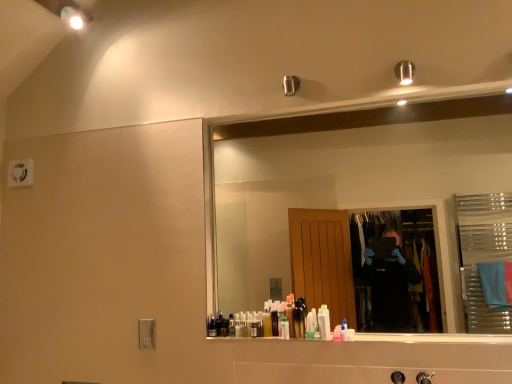
Question: From a real-world perspective, is translucent plastic bottle at center, the 4th toiletry when ordered from right to left, beneath white glossy lotion at center, which is the fifth toiletry from left to right?

Choices:
 (A) no
 (B) yes

Answer: (A)

Question: Is translucent plastic bottle at center, which is the third toiletry from left to right, thinner than white glossy lotion at center, which is the fifth toiletry from left to right?

Choices:
 (A) no
 (B) yes

Answer: (A)

Question: Is translucent plastic bottle at center, which is the third toiletry from left to right, not close to white glossy lotion at center, the 2th toiletry from the right?

Choices:
 (A) no
 (B) yes

Answer: (A)

Question: From the image's perspective, is translucent plastic bottle at center, which is the third toiletry from left to right, over white glossy lotion at center, the 2th toiletry from the right?

Choices:
 (A) yes
 (B) no

Answer: (A)

Question: Is white glossy lotion at center, which is the fifth toiletry from left to right, completely or partially inside translucent plastic bottle at center, the 4th toiletry when ordered from right to left?

Choices:
 (A) yes
 (B) no

Answer: (B)

Question: Is translucent plastic bottle at center, which is the third toiletry from left to right, completely or partially outside of white glossy lotion at center, which is the fifth toiletry from left to right?

Choices:
 (A) yes
 (B) no

Answer: (A)

Question: From a real-world perspective, is translucent plastic bottle at center, which is counted as the 4th toiletry, starting from the left, located higher than pink translucent bottle at center, which is the first toiletry in right-to-left order?

Choices:
 (A) no
 (B) yes

Answer: (B)

Question: Would you say translucent plastic bottle at center, which is counted as the 4th toiletry, starting from the left, contains pink translucent bottle at center, which is the first toiletry in right-to-left order?

Choices:
 (A) yes
 (B) no

Answer: (B)

Question: From a real-world perspective, is translucent plastic bottle at center, which is counted as the 4th toiletry, starting from the left, physically below pink translucent bottle at center, the 6th toiletry from the left?

Choices:
 (A) no
 (B) yes

Answer: (A)

Question: Does translucent plastic bottle at center, which is counted as the 4th toiletry, starting from the left, have a smaller size compared to pink translucent bottle at center, which is the first toiletry in right-to-left order?

Choices:
 (A) yes
 (B) no

Answer: (B)

Question: Is translucent plastic bottle at center, which is the third toiletry from right to left, taller than pink translucent bottle at center, the 6th toiletry from the left?

Choices:
 (A) no
 (B) yes

Answer: (B)

Question: Is translucent plastic bottle at center, which is counted as the 4th toiletry, starting from the left, shorter than pink translucent bottle at center, the 6th toiletry from the left?

Choices:
 (A) yes
 (B) no

Answer: (B)

Question: Can you confirm if translucent plastic tube at center, the fifth toiletry viewed from the right, is thinner than translucent plastic bottle at center, which is the third toiletry from right to left?

Choices:
 (A) no
 (B) yes

Answer: (A)